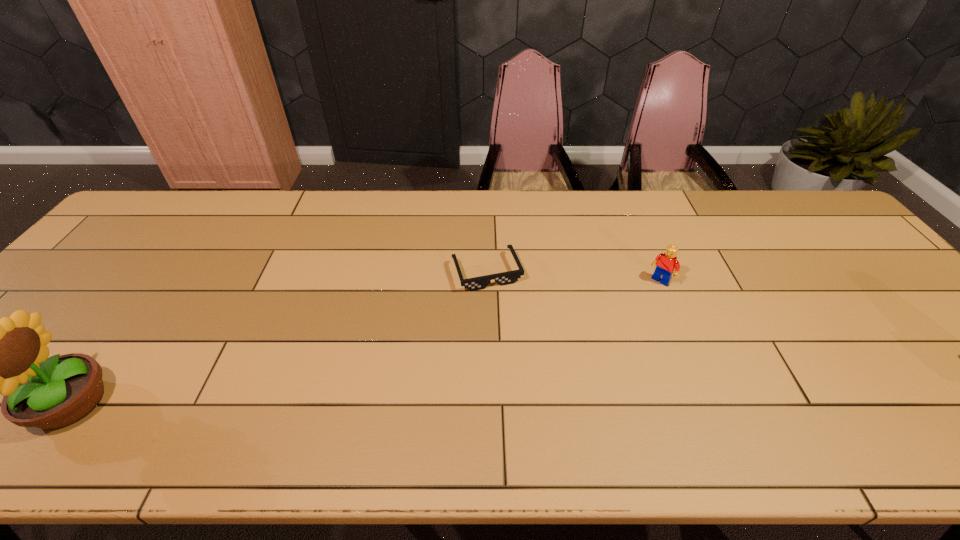
The width and height of the screenshot is (960, 540). What are the coordinates of `vacant space located on the front-facing side of the rightmost object` in the screenshot? It's located at (571, 376).

Locate an element on the screen. blank space located 0.070m on the front-facing side of the rightmost object is located at coordinates (642, 300).

The image size is (960, 540). What are the coordinates of `object situated at the near edge` in the screenshot? It's located at click(8, 356).

This screenshot has width=960, height=540. What are the coordinates of `vacant space at the far edge` in the screenshot? It's located at (630, 211).

This screenshot has height=540, width=960. What are the coordinates of `free space at the near edge` in the screenshot? It's located at (621, 387).

Where is `vacant space at the left edge of the desktop`? vacant space at the left edge of the desktop is located at coordinates (93, 299).

Image resolution: width=960 pixels, height=540 pixels. Identify the location of vacant space at the right edge of the desktop. (809, 237).

Image resolution: width=960 pixels, height=540 pixels. In the image, there is a desktop. In order to click on blank space at the far left corner in this screenshot , I will do `click(136, 210)`.

The width and height of the screenshot is (960, 540). In order to click on free space between the nearest object and the shortest object in this screenshot , I will do `click(279, 337)`.

At what (x,y) coordinates should I click in order to perform the action: click on empty location between the second shortest object and the leftmost object. Please return your answer as a coordinate pair (x, y). This screenshot has width=960, height=540. Looking at the image, I should click on (366, 341).